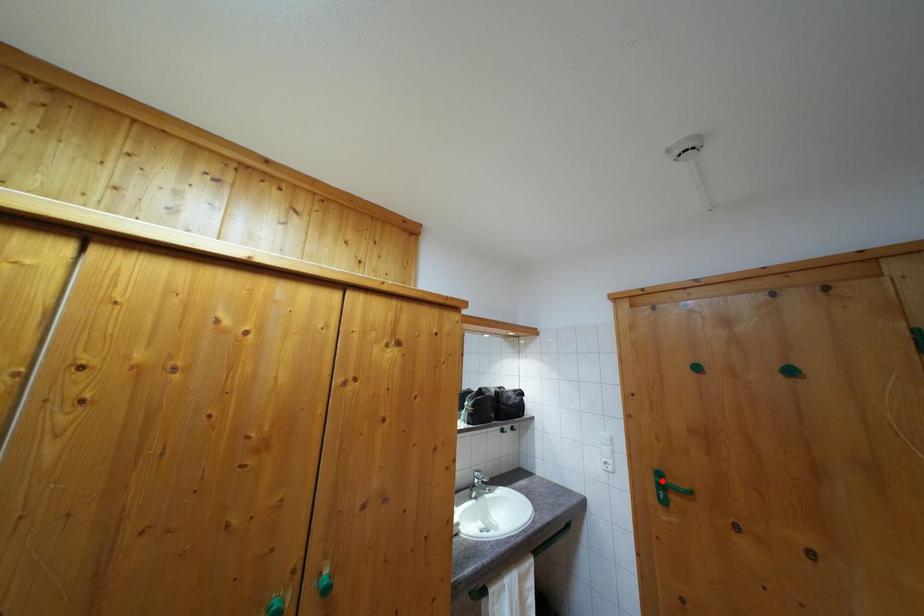
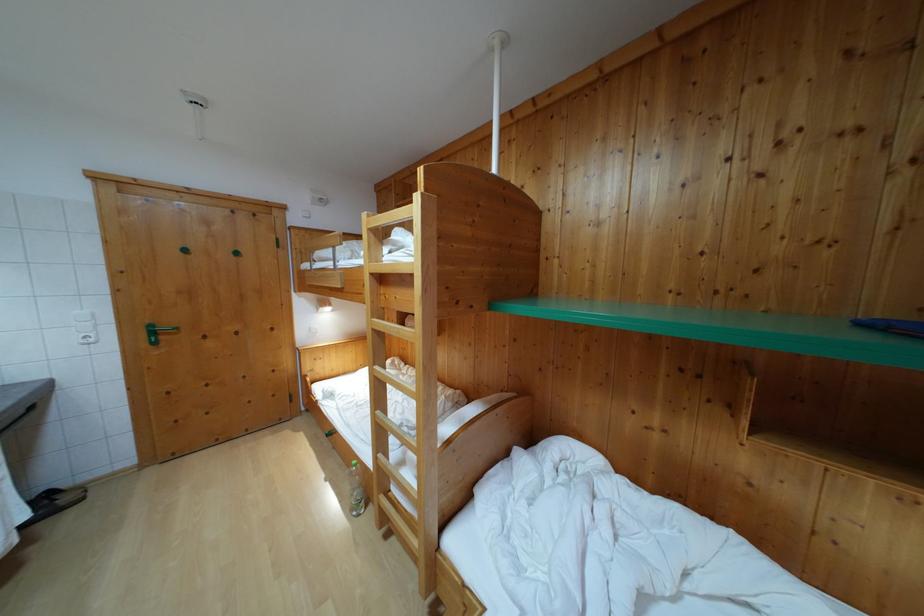
In the second image, find the point that corresponds to the highlighted location in the first image.

(155, 333)